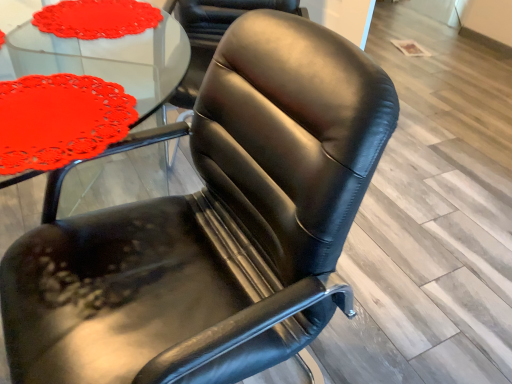
Question: From the image's perspective, is matte red doily at upper left located beneath black leather chair at center?

Choices:
 (A) yes
 (B) no

Answer: (A)

Question: From the image's perspective, is matte red doily at upper left located above black leather chair at center?

Choices:
 (A) yes
 (B) no

Answer: (B)

Question: Does matte red doily at upper left appear on the left side of black leather chair at center?

Choices:
 (A) no
 (B) yes

Answer: (B)

Question: Considering the relative sizes of matte red doily at upper left and black leather chair at center in the image provided, is matte red doily at upper left shorter than black leather chair at center?

Choices:
 (A) no
 (B) yes

Answer: (B)

Question: Is matte red doily at upper left at the right side of black leather chair at center?

Choices:
 (A) yes
 (B) no

Answer: (B)

Question: Can you confirm if matte red doily at upper left is wider than black leather chair at center?

Choices:
 (A) no
 (B) yes

Answer: (A)

Question: Considering the relative sizes of black leather chair at center and matte glass table at upper left in the image provided, is black leather chair at center shorter than matte glass table at upper left?

Choices:
 (A) no
 (B) yes

Answer: (A)

Question: Does black leather chair at center turn towards matte glass table at upper left?

Choices:
 (A) no
 (B) yes

Answer: (B)

Question: Does black leather chair at center have a larger size compared to matte glass table at upper left?

Choices:
 (A) yes
 (B) no

Answer: (A)

Question: Would you say black leather chair at center is outside matte glass table at upper left?

Choices:
 (A) no
 (B) yes

Answer: (B)

Question: From the image's perspective, is black leather chair at center on matte glass table at upper left?

Choices:
 (A) yes
 (B) no

Answer: (A)

Question: Is black leather chair at center to the left of matte glass table at upper left from the viewer's perspective?

Choices:
 (A) yes
 (B) no

Answer: (B)

Question: Is matte red doily at upper left surrounded by matte glass table at upper left?

Choices:
 (A) no
 (B) yes

Answer: (A)